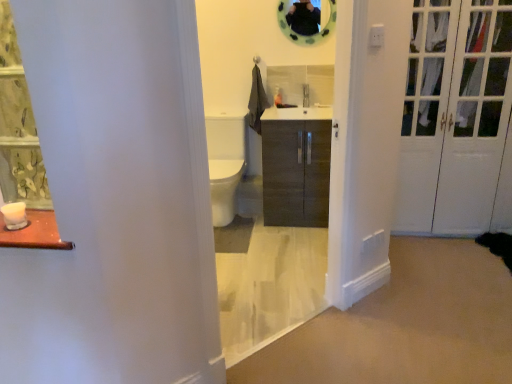
Question: Can you confirm if green floral fabric curtain at left is thinner than matte wood cabinet at center?

Choices:
 (A) no
 (B) yes

Answer: (B)

Question: Is green floral fabric curtain at left touching matte wood cabinet at center?

Choices:
 (A) no
 (B) yes

Answer: (A)

Question: Can you confirm if green floral fabric curtain at left is positioned to the right of matte wood cabinet at center?

Choices:
 (A) no
 (B) yes

Answer: (A)

Question: Is green floral fabric curtain at left aimed at matte wood cabinet at center?

Choices:
 (A) yes
 (B) no

Answer: (B)

Question: Does green floral fabric curtain at left appear on the left side of matte wood cabinet at center?

Choices:
 (A) yes
 (B) no

Answer: (A)

Question: Relative to green floral fabric curtain at left, is matte wood cabinet at center in front or behind?

Choices:
 (A) behind
 (B) front

Answer: (B)

Question: Considering the relative positions of matte wood cabinet at center and green floral fabric curtain at left in the image provided, is matte wood cabinet at center to the left or to the right of green floral fabric curtain at left?

Choices:
 (A) right
 (B) left

Answer: (A)

Question: Which is correct: matte wood cabinet at center is inside green floral fabric curtain at left, or outside of it?

Choices:
 (A) outside
 (B) inside

Answer: (A)

Question: From a real-world perspective, is matte wood cabinet at center positioned above or below green floral fabric curtain at left?

Choices:
 (A) above
 (B) below

Answer: (B)

Question: In the image, is dark wood cabinet at center positioned in front of or behind matte wood cabinet at center?

Choices:
 (A) front
 (B) behind

Answer: (B)

Question: From the image's perspective, is dark wood cabinet at center above or below matte wood cabinet at center?

Choices:
 (A) below
 (B) above

Answer: (B)

Question: Does point (298, 134) appear closer or farther from the camera than point (280, 286)?

Choices:
 (A) farther
 (B) closer

Answer: (A)

Question: Choose the correct answer: Is dark wood cabinet at center inside matte wood cabinet at center or outside it?

Choices:
 (A) outside
 (B) inside

Answer: (A)

Question: Is point (22, 182) closer or farther from the camera than point (247, 54)?

Choices:
 (A) farther
 (B) closer

Answer: (B)

Question: Based on their positions, is green floral fabric curtain at left located to the left or right of matte wood cabinet at center?

Choices:
 (A) left
 (B) right

Answer: (A)